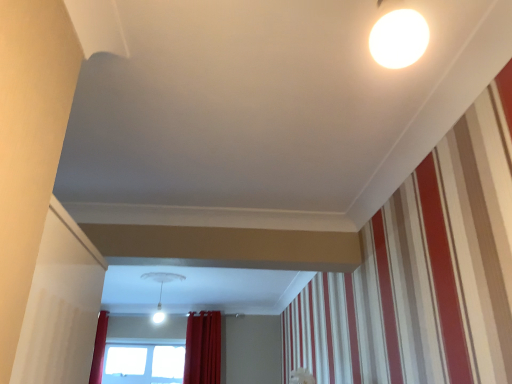
Identify the location of transparent glass window at lower center. (143, 362).

Find the location of a particular element. Image resolution: width=512 pixels, height=384 pixels. transparent glass window at lower center is located at coordinates (143, 362).

Considering the relative sizes of transparent glass window at lower center and red velvet curtain at lower center in the image provided, is transparent glass window at lower center wider than red velvet curtain at lower center?

In fact, transparent glass window at lower center might be narrower than red velvet curtain at lower center.

Are transparent glass window at lower center and red velvet curtain at lower center far apart?

No, transparent glass window at lower center is not far from red velvet curtain at lower center.

Is transparent glass window at lower center taller than red velvet curtain at lower center?

No.

Looking at the image, does transparent glass window at lower center seem bigger or smaller compared to red velvet curtain at lower center?

Considering their sizes, transparent glass window at lower center takes up less space than red velvet curtain at lower center.

Locate an element on the screen. curtain below the white glossy light fixture at center (from the image's perspective) is located at coordinates (203, 348).

Does red velvet curtain at lower center have a smaller size compared to white glossy light fixture at center?

No, red velvet curtain at lower center is not smaller than white glossy light fixture at center.

Looking at this image, from a real-world perspective, does red velvet curtain at lower center stand above white glossy light fixture at center?

No, from a real-world perspective, red velvet curtain at lower center is not on top of white glossy light fixture at center.

Is red velvet curtain at lower center oriented towards white glossy light fixture at center?

Yes, red velvet curtain at lower center faces towards white glossy light fixture at center.

Is transparent glass window at lower center wider or thinner than white glossy light fixture at center?

In the image, transparent glass window at lower center appears to be more narrow than white glossy light fixture at center.

From a real-world perspective, who is located higher, transparent glass window at lower center or white glossy light fixture at center?

white glossy light fixture at center is physically above.

Does transparent glass window at lower center turn towards white glossy light fixture at center?

Yes, transparent glass window at lower center is aimed at white glossy light fixture at center.

Does transparent glass window at lower center have a smaller size compared to white glossy light fixture at center?

Yes, transparent glass window at lower center is smaller than white glossy light fixture at center.

Is white glossy light fixture at center further to camera compared to red velvet curtain at lower center?

That is False.

Which object is thinner, white glossy light fixture at center or red velvet curtain at lower center?

With smaller width is red velvet curtain at lower center.

From the image's perspective, is white glossy light fixture at center located above or below red velvet curtain at lower center?

From the image's perspective, white glossy light fixture at center appears above red velvet curtain at lower center.

Is white glossy light fixture at center not near red velvet curtain at lower center?

Yes, white glossy light fixture at center and red velvet curtain at lower center are quite far apart.

Are red velvet curtain at lower center and transparent glass window at lower center making contact?

No, red velvet curtain at lower center is not next to transparent glass window at lower center.

From the picture: From a real-world perspective, is red velvet curtain at lower center above or below transparent glass window at lower center?

red velvet curtain at lower center is situated higher than transparent glass window at lower center in the real world.

Is red velvet curtain at lower center looking in the opposite direction of transparent glass window at lower center?

That's not correct — red velvet curtain at lower center is not looking away from transparent glass window at lower center.

Is red velvet curtain at lower center taller than transparent glass window at lower center?

Correct, red velvet curtain at lower center is much taller as transparent glass window at lower center.

Is white glossy light fixture at center outside of transparent glass window at lower center?

white glossy light fixture at center lies outside transparent glass window at lower center's area.

Is white glossy light fixture at center far from transparent glass window at lower center?

Indeed, white glossy light fixture at center is not near transparent glass window at lower center.

Image resolution: width=512 pixels, height=384 pixels. Find the location of `window that is on the left side of white glossy light fixture at center`. window that is on the left side of white glossy light fixture at center is located at coordinates (143, 362).

The height and width of the screenshot is (384, 512). What are the coordinates of `window located below the red velvet curtain at lower center (from the image's perspective)` in the screenshot? It's located at (143, 362).

Locate an element on the screen. This screenshot has width=512, height=384. light fixture on the left of red velvet curtain at lower center is located at coordinates (161, 289).

Based on their spatial positions, is red velvet curtain at lower center or white glossy light fixture at center closer to transparent glass window at lower center?

red velvet curtain at lower center is positioned closer to the anchor transparent glass window at lower center.

Estimate the real-world distances between objects in this image. Which object is further from transparent glass window at lower center, white glossy light fixture at center or red velvet curtain at lower center?

white glossy light fixture at center is further to transparent glass window at lower center.

Based on their spatial positions, is transparent glass window at lower center or white glossy light fixture at center closer to red velvet curtain at lower center?

The object closer to red velvet curtain at lower center is transparent glass window at lower center.

Based on their spatial positions, is white glossy light fixture at center or transparent glass window at lower center further from red velvet curtain at lower center?

Among the two, white glossy light fixture at center is located further to red velvet curtain at lower center.

Which object lies further to the anchor point white glossy light fixture at center, transparent glass window at lower center or red velvet curtain at lower center?

transparent glass window at lower center is further to white glossy light fixture at center.

Considering their positions, is red velvet curtain at lower center positioned closer to white glossy light fixture at center than transparent glass window at lower center?

red velvet curtain at lower center is closer to white glossy light fixture at center.

Find the location of a particular element. curtain between white glossy light fixture at center and transparent glass window at lower center along the z-axis is located at coordinates (203, 348).